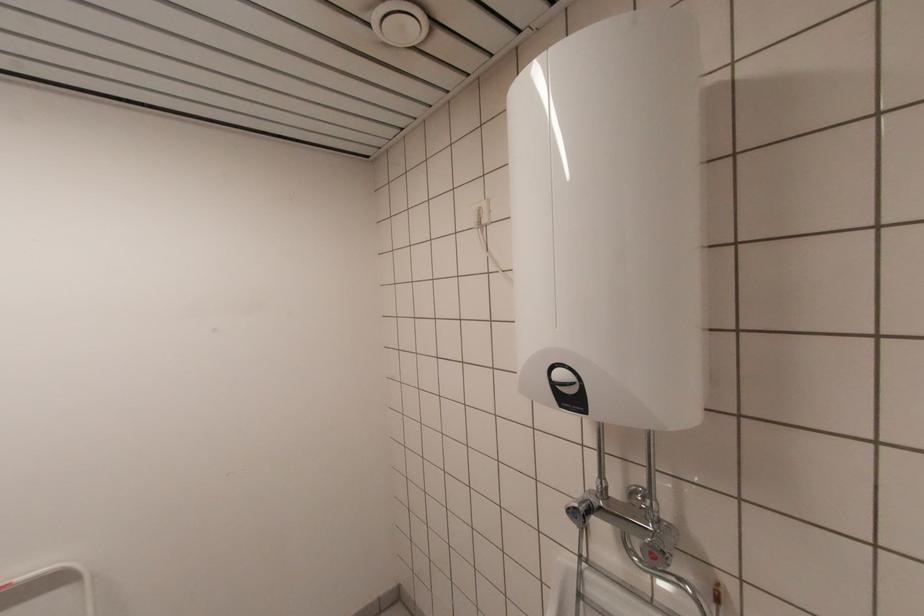
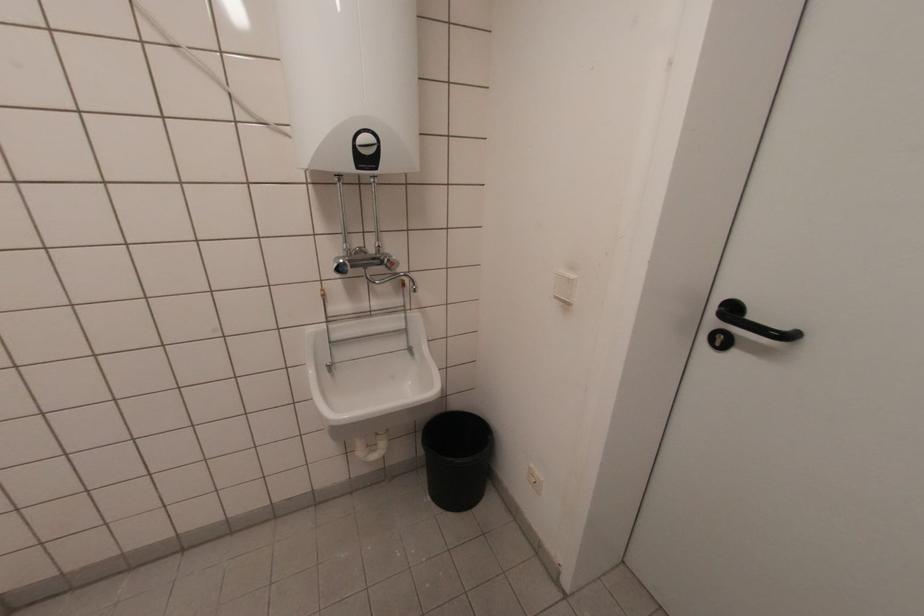
Locate, in the second image, the point that corresponds to point (661, 522) in the first image.

(383, 254)